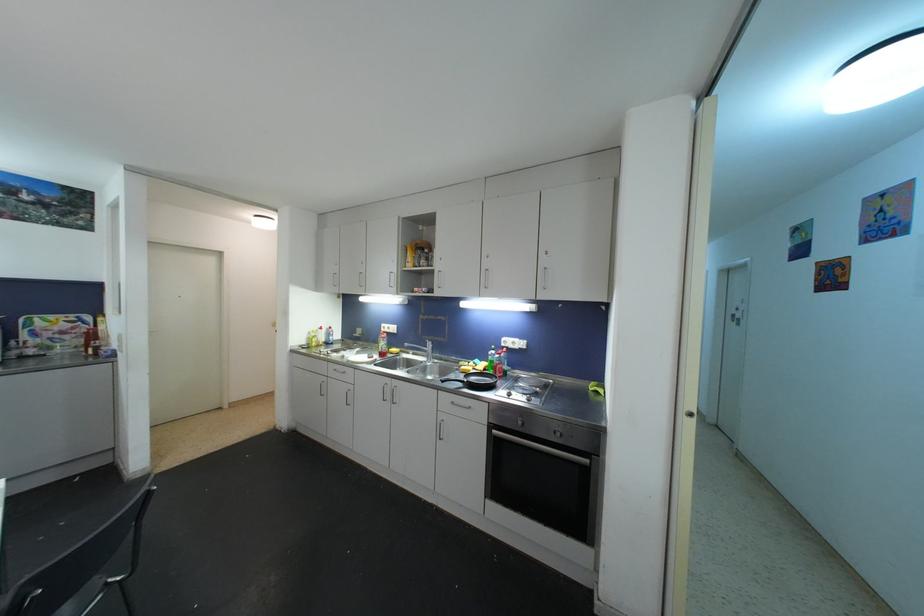
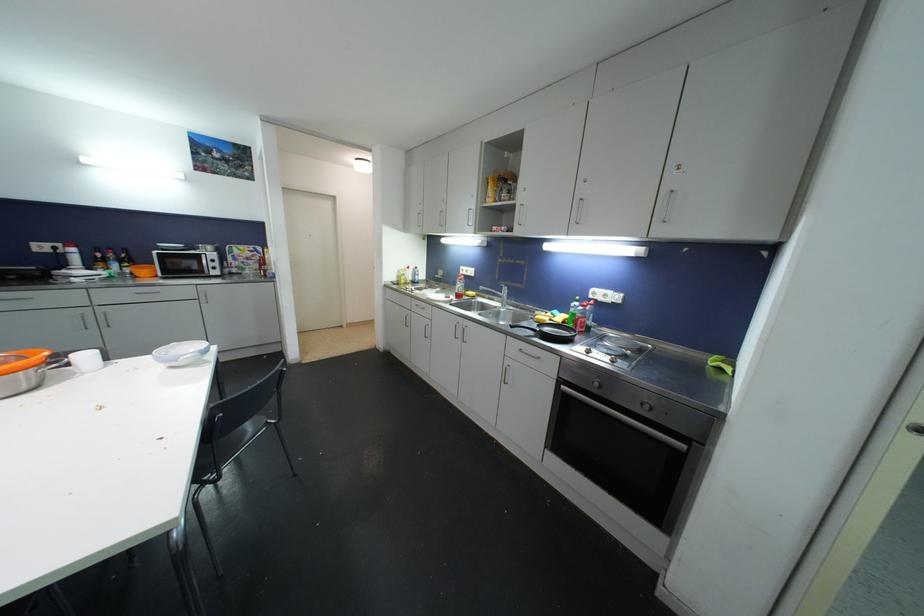
The point at (391, 399) is marked in the first image. Where is the corresponding point in the second image?

(463, 338)